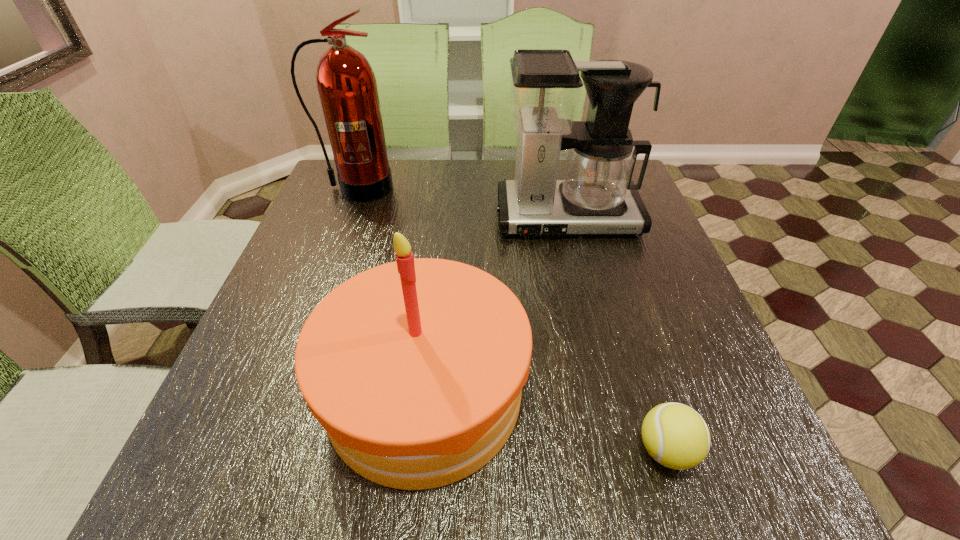
The image size is (960, 540). Find the location of `birthday cake positioned at the near edge`. birthday cake positioned at the near edge is located at coordinates (415, 368).

Locate an element on the screen. This screenshot has width=960, height=540. tennis ball situated at the near edge is located at coordinates (675, 435).

Find the location of a particular element. The image size is (960, 540). object present at the left edge is located at coordinates point(347,87).

In order to click on coffee maker that is at the right edge in this screenshot , I will do `click(596, 196)`.

The width and height of the screenshot is (960, 540). Identify the location of tennis ball that is at the right edge. (675, 435).

You are a GUI agent. You are given a task and a screenshot of the screen. Output one action in this format:
    pyautogui.click(x=<x>, y=<y>)
    Task: Click on the object that is positioned at the far left corner
    The width and height of the screenshot is (960, 540).
    Given the screenshot: What is the action you would take?
    click(347, 87)

This screenshot has width=960, height=540. I want to click on object at the far right corner, so click(x=596, y=196).

Find the location of `object that is at the near right corner`. object that is at the near right corner is located at coordinates (675, 435).

In the image, there is a desktop. Where is `blank space at the far edge`? blank space at the far edge is located at coordinates click(x=449, y=164).

I want to click on vacant space at the near edge of the desktop, so click(467, 485).